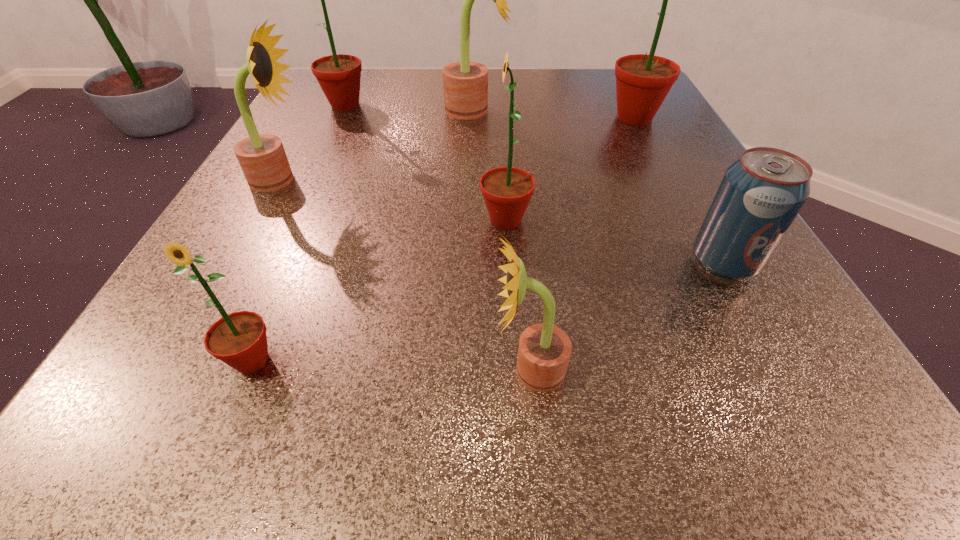
Where is `the tallest object`? This screenshot has width=960, height=540. the tallest object is located at coordinates (643, 81).

The image size is (960, 540). Identify the location of the tallest sunflower. (643, 81).

Identify the location of the biggest yellow sunflower. (465, 84).

Locate an element on the screen. Image resolution: width=960 pixels, height=540 pixels. the third smallest green sunflower is located at coordinates (339, 76).

Where is `the fourth farthest sunflower`? The height and width of the screenshot is (540, 960). the fourth farthest sunflower is located at coordinates (262, 158).

Locate an element on the screen. Image resolution: width=960 pixels, height=540 pixels. the leftmost yellow sunflower is located at coordinates (262, 158).

Locate an element on the screen. the second green sunflower from right to left is located at coordinates (507, 191).

In order to click on the third biggest green sunflower in this screenshot , I will do `click(507, 191)`.

I want to click on the smallest yellow sunflower, so tap(544, 351).

Find the location of a particular element. the smallest green sunflower is located at coordinates (239, 339).